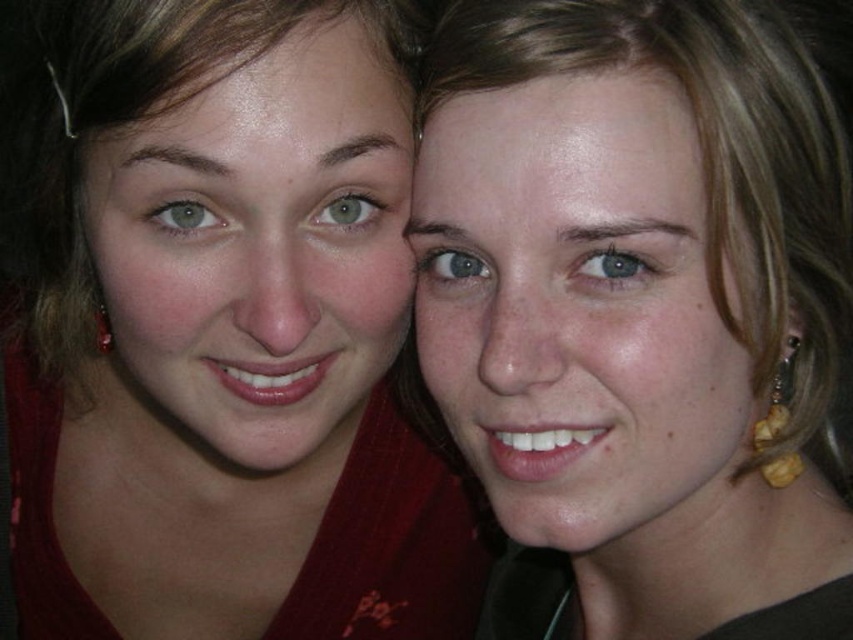
Can you confirm if matte red shirt at left is smaller than matte gold earrings at right?

Incorrect, matte red shirt at left is not smaller in size than matte gold earrings at right.

The width and height of the screenshot is (853, 640). What do you see at coordinates (224, 333) in the screenshot?
I see `matte red shirt at left` at bounding box center [224, 333].

Measure the distance between matte red shirt at left and camera.

A distance of 18.48 inches exists between matte red shirt at left and camera.

Locate an element on the screen. The image size is (853, 640). matte red shirt at left is located at coordinates (224, 333).